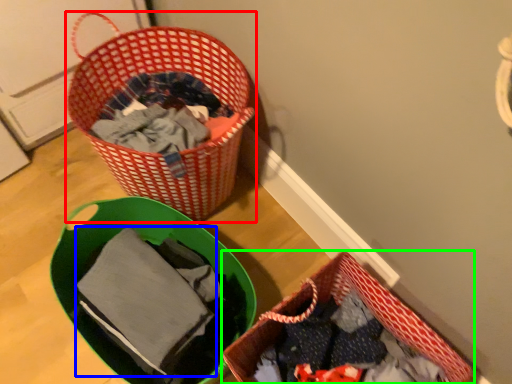
Question: Which object is positioned farthest from picnic basket (highlighted by a red box)? Select from baby clothe (highlighted by a blue box) and picnic basket (highlighted by a green box).

Choices:
 (A) baby clothe
 (B) picnic basket

Answer: (B)